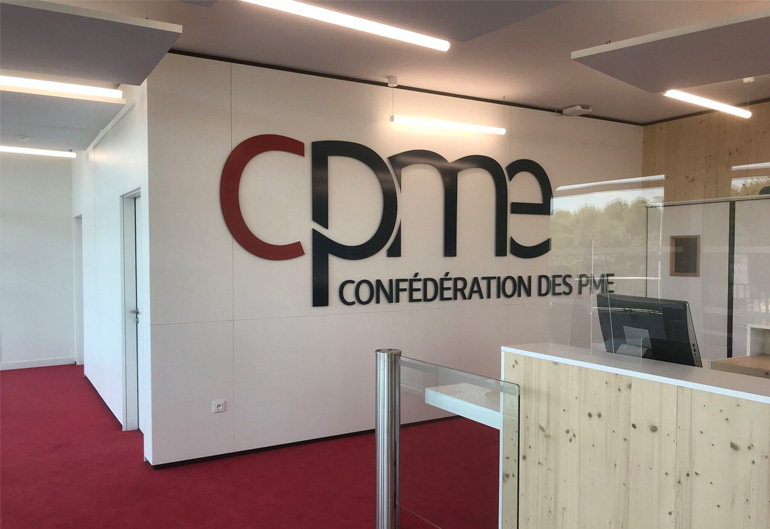
Image resolution: width=770 pixels, height=529 pixels. Identify the location of 1 red carpet. (316, 488).